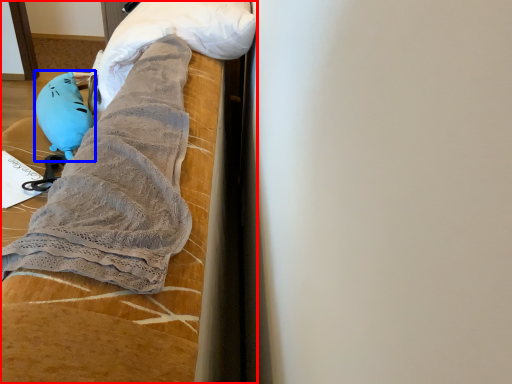
Question: Which object is closer to the camera taking this photo, furniture (highlighted by a red box) or toy (highlighted by a blue box)?

Choices:
 (A) furniture
 (B) toy

Answer: (A)